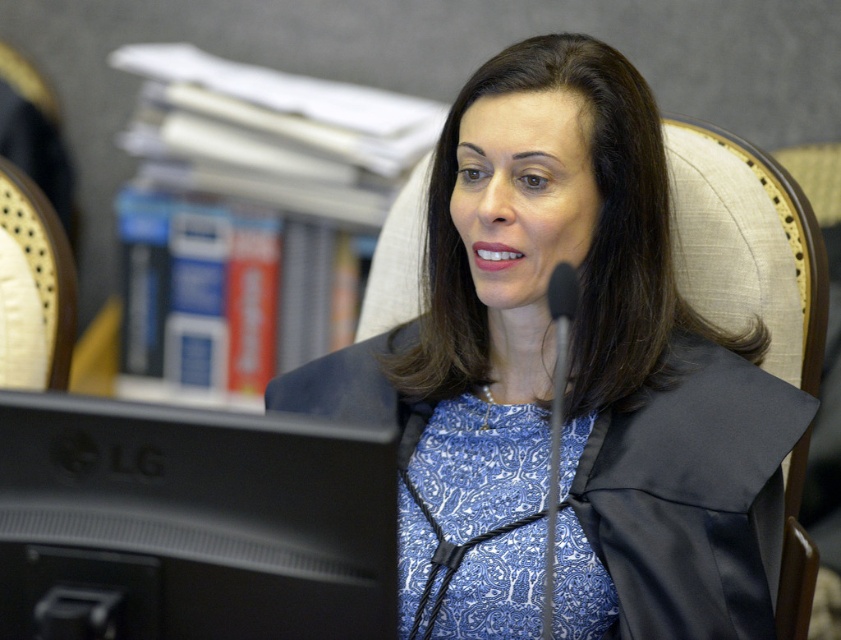
Question: Is blue printed dress at center above metallic silver microphone at center?

Choices:
 (A) no
 (B) yes

Answer: (B)

Question: Which of the following is the farthest from the observer?

Choices:
 (A) (193, 468)
 (B) (468, 147)
 (C) (556, 288)

Answer: (B)

Question: Is blue printed dress at center thinner than black matte monitor at lower left?

Choices:
 (A) no
 (B) yes

Answer: (A)

Question: Among these objects, which one is nearest to the camera?

Choices:
 (A) metallic silver microphone at center
 (B) blue printed dress at center
 (C) black matte monitor at lower left

Answer: (C)

Question: In this image, where is black matte monitor at lower left located relative to metallic silver microphone at center?

Choices:
 (A) right
 (B) left

Answer: (B)

Question: Which of the following is the closest to the observer?

Choices:
 (A) metallic silver microphone at center
 (B) blue printed dress at center
 (C) black matte monitor at lower left

Answer: (C)